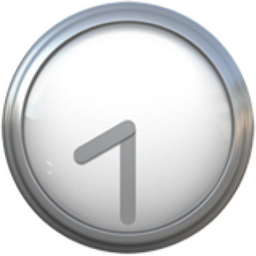
In order to click on frame in this screenshot , I will do `click(193, 228)`.